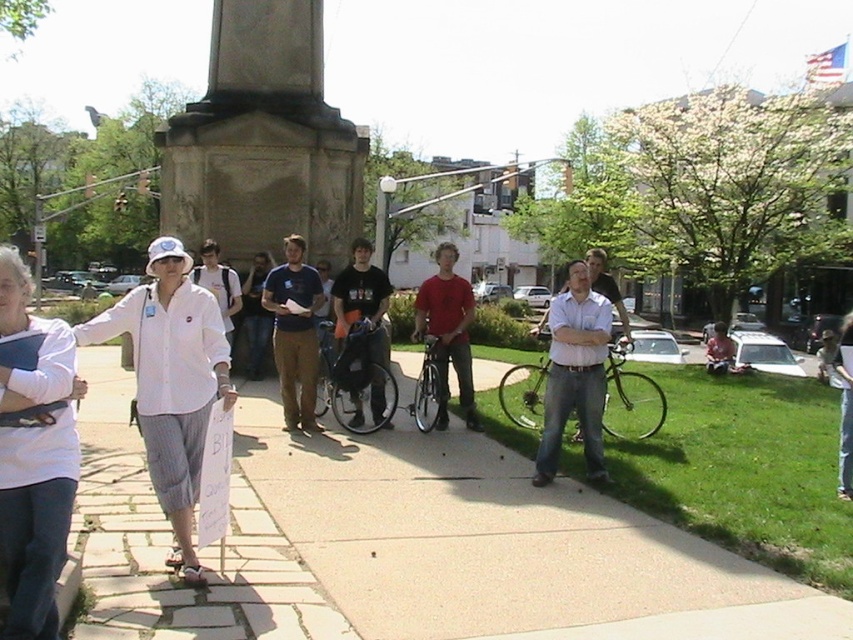
You are a photographer standing at the center of the paved area near the monument. You want to take a photo that includes the white cotton shirt at left and the monument. Where should you position yourself to ensure both are in the frame?

Position yourself centrally between the monument and the white cotton shirt at left to include both in the frame.

You are a photographer trying to capture a photo of the gray stone monument at center and the matte red shirt at center in the scene. Based on their sizes, which object should you focus on first to ensure both are in frame without needing to adjust your camera angle?

The gray stone monument at center is smaller than the matte red shirt at center, so you should focus on the matte red shirt at center first to ensure it fits within the frame while accommodating the smaller monument.